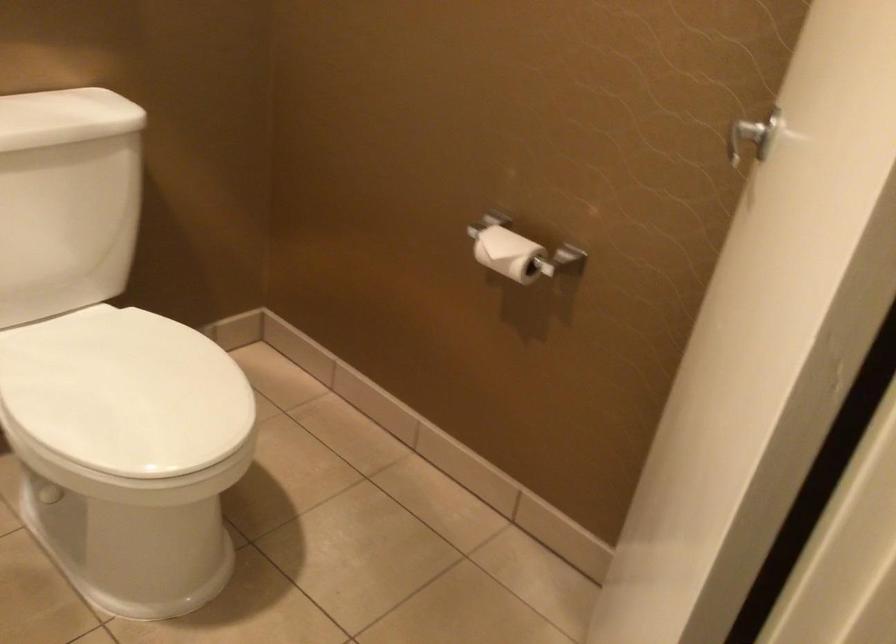
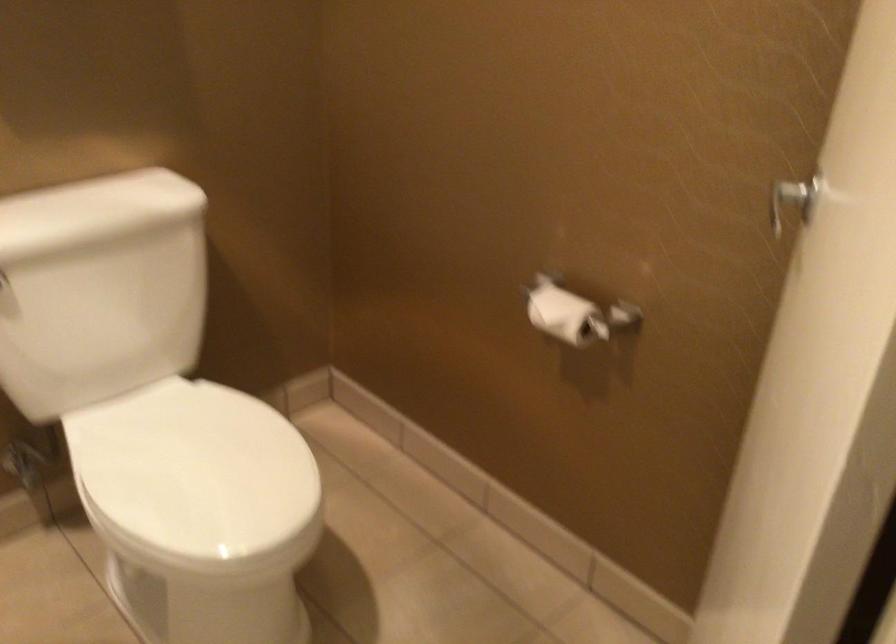
Question: How did the camera likely rotate?

Choices:
 (A) Left
 (B) Right
 (C) Up
 (D) Down

Answer: (A)